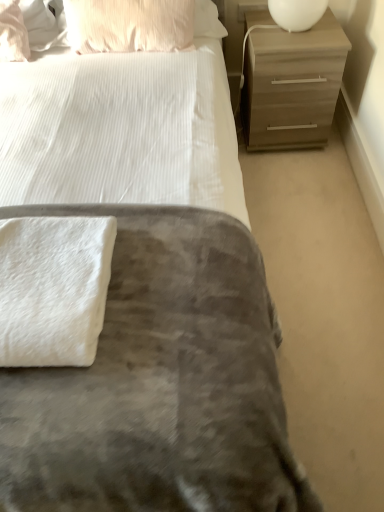
Identify the location of white glossy lampshade at upper right. This screenshot has width=384, height=512. (297, 13).

This screenshot has height=512, width=384. Describe the element at coordinates (297, 13) in the screenshot. I see `white glossy lampshade at upper right` at that location.

The width and height of the screenshot is (384, 512). What do you see at coordinates (13, 33) in the screenshot? I see `matte pink pillow at upper left, the 2th pillow positioned from the right` at bounding box center [13, 33].

The width and height of the screenshot is (384, 512). What do you see at coordinates (129, 25) in the screenshot?
I see `pink textured pillow at upper left, the 2th pillow when ordered from left to right` at bounding box center [129, 25].

Where is `white glossy lampshade at upper right`? This screenshot has height=512, width=384. white glossy lampshade at upper right is located at coordinates point(297,13).

Are white fluffy bath towel at lower left and matte pink pillow at upper left, the 2th pillow positioned from the right, far apart?

Yes, white fluffy bath towel at lower left and matte pink pillow at upper left, the 2th pillow positioned from the right, are quite far apart.

Is point (65, 310) behind point (9, 59)?

No.

Which of these two, white fluffy bath towel at lower left or matte pink pillow at upper left, acting as the first pillow starting from the left, stands shorter?

Standing shorter between the two is white fluffy bath towel at lower left.

Which of these two, white fluffy bath towel at lower left or matte pink pillow at upper left, acting as the first pillow starting from the left, is bigger?

white fluffy bath towel at lower left is bigger.

Is white glossy lampshade at upper right wider than white fluffy bath towel at lower left?

Incorrect, the width of white glossy lampshade at upper right does not surpass that of white fluffy bath towel at lower left.

Which object is closer to the camera, white glossy lampshade at upper right or white fluffy bath towel at lower left?

Positioned in front is white fluffy bath towel at lower left.

Considering the relative sizes of white glossy lampshade at upper right and white fluffy bath towel at lower left in the image provided, is white glossy lampshade at upper right smaller than white fluffy bath towel at lower left?

Yes.

Considering the points (317, 17) and (10, 246), which point is behind, point (317, 17) or point (10, 246)?

The point (317, 17) is more distant.

Locate an element on the screen. pillow that is the 2nd one when counting upward from the matte brown chest of drawers at upper right (from the image's perspective) is located at coordinates (129, 25).

Do you think matte brown chest of drawers at upper right is within pink textured pillow at upper left, the first pillow in the right-to-left sequence, or outside of it?

matte brown chest of drawers at upper right is not enclosed by pink textured pillow at upper left, the first pillow in the right-to-left sequence.

Is point (274, 62) positioned before point (99, 42)?

Yes, point (274, 62) is closer to viewer.

Based on the photo, from a real-world perspective, between matte brown chest of drawers at upper right and pink textured pillow at upper left, the first pillow in the right-to-left sequence, who is vertically higher?

pink textured pillow at upper left, the first pillow in the right-to-left sequence, from a real-world perspective.

Which is behind, point (4, 11) or point (270, 12)?

Positioned behind is point (4, 11).

Considering the relative sizes of matte pink pillow at upper left, the 2th pillow positioned from the right, and white glossy lampshade at upper right in the image provided, is matte pink pillow at upper left, the 2th pillow positioned from the right, taller than white glossy lampshade at upper right?

Correct, matte pink pillow at upper left, the 2th pillow positioned from the right, is much taller as white glossy lampshade at upper right.

Is matte pink pillow at upper left, acting as the first pillow starting from the left, positioned far away from white glossy lampshade at upper right?

Yes.

Is point (13, 44) in front of point (61, 310)?

No, (13, 44) is further to viewer.

Considering the relative sizes of matte pink pillow at upper left, acting as the first pillow starting from the left, and white fluffy bath towel at lower left in the image provided, is matte pink pillow at upper left, acting as the first pillow starting from the left, thinner than white fluffy bath towel at lower left?

Yes, matte pink pillow at upper left, acting as the first pillow starting from the left, is thinner than white fluffy bath towel at lower left.

From a real-world perspective, which object rests below the other?

white fluffy bath towel at lower left is physically lower.

Considering the sizes of objects matte pink pillow at upper left, acting as the first pillow starting from the left, and white fluffy bath towel at lower left in the image provided, who is bigger, matte pink pillow at upper left, acting as the first pillow starting from the left, or white fluffy bath towel at lower left?

With larger size is white fluffy bath towel at lower left.

Is pink textured pillow at upper left, the first pillow in the right-to-left sequence, directly adjacent to white fluffy bath towel at lower left?

They are not placed beside each other.

Is point (81, 2) in front of point (96, 328)?

No.

Does pink textured pillow at upper left, the first pillow in the right-to-left sequence, appear on the right side of white fluffy bath towel at lower left?

Correct, you'll find pink textured pillow at upper left, the first pillow in the right-to-left sequence, to the right of white fluffy bath towel at lower left.

From the image's perspective, between pink textured pillow at upper left, the first pillow in the right-to-left sequence, and white fluffy bath towel at lower left, who is located below?

white fluffy bath towel at lower left.

Does matte pink pillow at upper left, the 2th pillow positioned from the right, have a greater width compared to pink textured pillow at upper left, the first pillow in the right-to-left sequence?

Yes.

From the image's perspective, between matte pink pillow at upper left, the 2th pillow positioned from the right, and pink textured pillow at upper left, the 2th pillow when ordered from left to right, who is located below?

matte pink pillow at upper left, the 2th pillow positioned from the right, from the image's perspective.

Is pink textured pillow at upper left, the 2th pillow when ordered from left to right, inside matte pink pillow at upper left, the 2th pillow positioned from the right?

No, pink textured pillow at upper left, the 2th pillow when ordered from left to right, is not surrounded by matte pink pillow at upper left, the 2th pillow positioned from the right.

Is matte pink pillow at upper left, acting as the first pillow starting from the left, far away from pink textured pillow at upper left, the 2th pillow when ordered from left to right?

Actually, matte pink pillow at upper left, acting as the first pillow starting from the left, and pink textured pillow at upper left, the 2th pillow when ordered from left to right, are a little close together.

You are a GUI agent. You are given a task and a screenshot of the screen. Output one action in this format:
    pyautogui.click(x=<x>, y=<y>)
    Task: Click on the 1st pillow above the white fluffy bath towel at lower left (from the image's perspective)
    This screenshot has height=512, width=384.
    Given the screenshot: What is the action you would take?
    pyautogui.click(x=13, y=33)

You are a GUI agent. You are given a task and a screenshot of the screen. Output one action in this format:
    pyautogui.click(x=<x>, y=<y>)
    Task: Click on the bath towel on the left side of white glossy lampshade at upper right
    Image resolution: width=384 pixels, height=512 pixels.
    Given the screenshot: What is the action you would take?
    pyautogui.click(x=53, y=289)

Which object lies nearer to the anchor point white fluffy bath towel at lower left, pink textured pillow at upper left, the 2th pillow when ordered from left to right, or matte pink pillow at upper left, acting as the first pillow starting from the left?

Based on the image, pink textured pillow at upper left, the 2th pillow when ordered from left to right, appears to be nearer to white fluffy bath towel at lower left.

Looking at the image, which one is located further to white glossy lampshade at upper right, matte brown chest of drawers at upper right or matte pink pillow at upper left, acting as the first pillow starting from the left?

matte pink pillow at upper left, acting as the first pillow starting from the left, lies further to white glossy lampshade at upper right than the other object.

From the image, which object appears to be nearer to white glossy lampshade at upper right, matte pink pillow at upper left, acting as the first pillow starting from the left, or matte brown chest of drawers at upper right?

matte brown chest of drawers at upper right is closer to white glossy lampshade at upper right.

Which object lies further to the anchor point white glossy lampshade at upper right, matte brown chest of drawers at upper right or pink textured pillow at upper left, the 2th pillow when ordered from left to right?

pink textured pillow at upper left, the 2th pillow when ordered from left to right.

From the picture: When comparing their distances from matte brown chest of drawers at upper right, does matte pink pillow at upper left, the 2th pillow positioned from the right, or white glossy lampshade at upper right seem further?

Based on the image, matte pink pillow at upper left, the 2th pillow positioned from the right, appears to be further to matte brown chest of drawers at upper right.

When comparing their distances from white fluffy bath towel at lower left, does matte pink pillow at upper left, acting as the first pillow starting from the left, or white glossy lampshade at upper right seem further?

white glossy lampshade at upper right is positioned further to the anchor white fluffy bath towel at lower left.

Looking at the image, which one is located closer to matte pink pillow at upper left, the 2th pillow positioned from the right, white glossy lampshade at upper right or white fluffy bath towel at lower left?

white glossy lampshade at upper right is closer to matte pink pillow at upper left, the 2th pillow positioned from the right.

Considering their positions, is matte brown chest of drawers at upper right positioned further to white fluffy bath towel at lower left than pink textured pillow at upper left, the first pillow in the right-to-left sequence?

matte brown chest of drawers at upper right is further to white fluffy bath towel at lower left.

Locate an element on the screen. chest of drawers between pink textured pillow at upper left, the first pillow in the right-to-left sequence, and white fluffy bath towel at lower left, in the vertical direction is located at coordinates (291, 83).

Identify the location of pillow situated between matte pink pillow at upper left, acting as the first pillow starting from the left, and matte brown chest of drawers at upper right from left to right. The width and height of the screenshot is (384, 512). (129, 25).

The height and width of the screenshot is (512, 384). Find the location of `chest of drawers between white glossy lampshade at upper right and white fluffy bath towel at lower left in the up-down direction`. chest of drawers between white glossy lampshade at upper right and white fluffy bath towel at lower left in the up-down direction is located at coordinates (291, 83).

This screenshot has height=512, width=384. I want to click on pillow between matte pink pillow at upper left, acting as the first pillow starting from the left, and white glossy lampshade at upper right, so (129, 25).